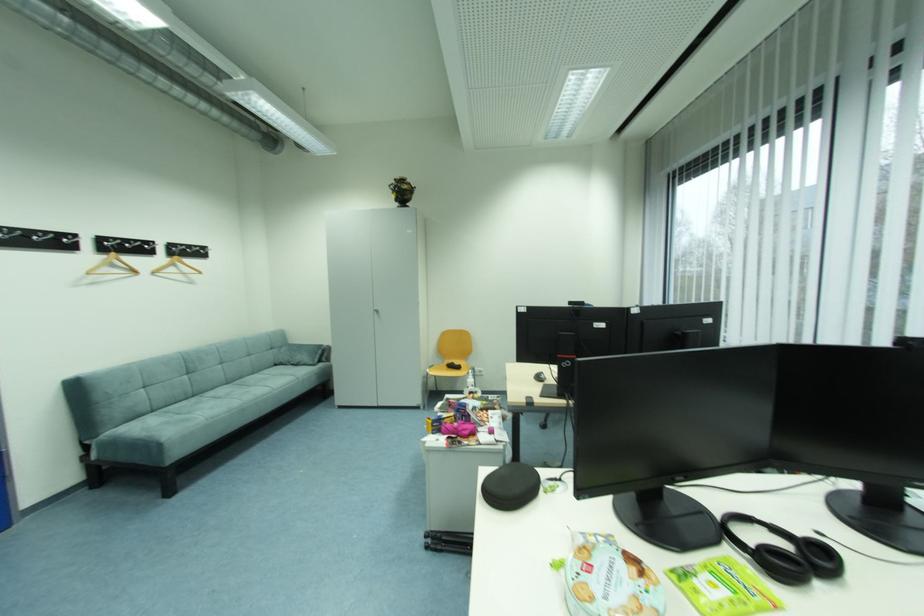
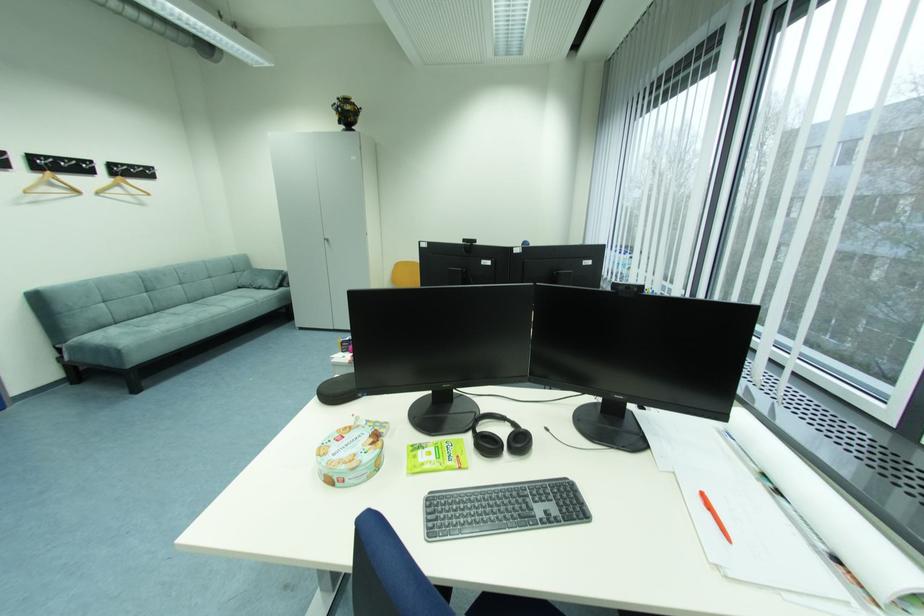
Question: The images are taken continuously from a first-person perspective. In which direction are you moving?

Choices:
 (A) Left
 (B) Right
 (C) Forward
 (D) Backward

Answer: (B)